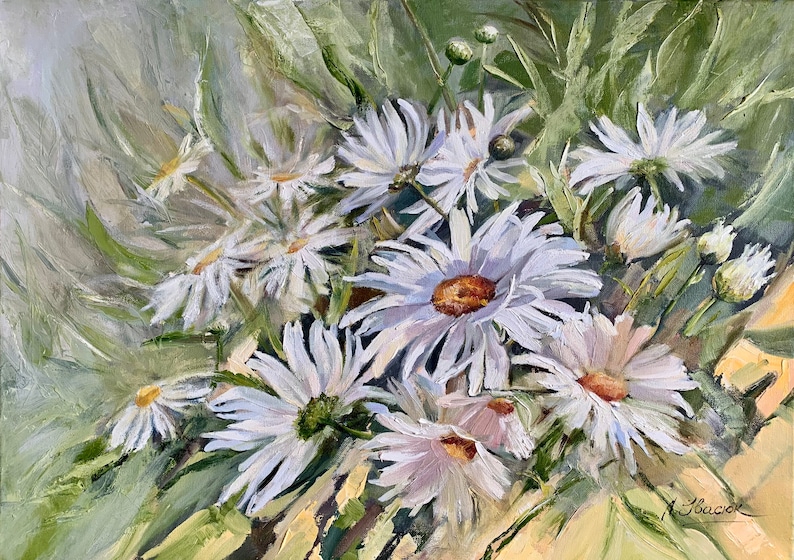
The height and width of the screenshot is (560, 794). What are the coordinates of `upper left corner of painting` in the screenshot? It's located at (0, 0).